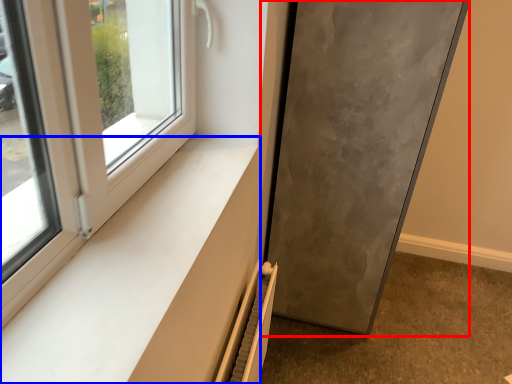
Question: Which point is closer to the camera, door (highlighted by a red box) or window sill (highlighted by a blue box)?

Choices:
 (A) door
 (B) window sill

Answer: (B)